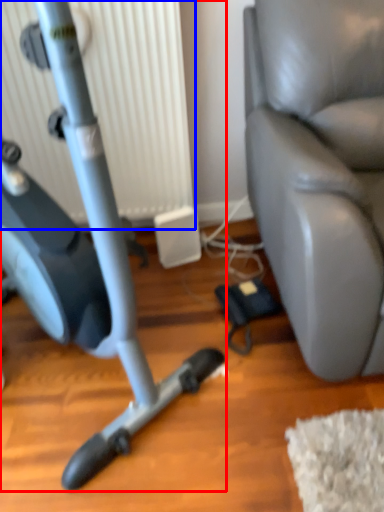
Question: Among these objects, which one is farthest to the camera, stationary bicycle (highlighted by a red box) or radiator (highlighted by a blue box)?

Choices:
 (A) stationary bicycle
 (B) radiator

Answer: (B)